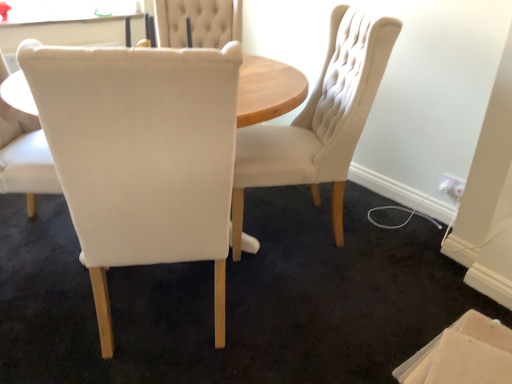
Question: Could beige cardboard box at lower right be considered to be inside matte cream chair at center, which appears as the third chair when viewed from the left?

Choices:
 (A) no
 (B) yes

Answer: (A)

Question: From a real-world perspective, is matte cream chair at center, arranged as the first chair when viewed from the right, beneath beige cardboard box at lower right?

Choices:
 (A) no
 (B) yes

Answer: (A)

Question: Can you confirm if matte cream chair at center, which appears as the third chair when viewed from the left, is positioned to the left of beige cardboard box at lower right?

Choices:
 (A) no
 (B) yes

Answer: (B)

Question: Is beige cardboard box at lower right at the back of matte cream chair at center, arranged as the first chair when viewed from the right?

Choices:
 (A) no
 (B) yes

Answer: (A)

Question: Is matte cream chair at center, which appears as the third chair when viewed from the left, to the right of beige cardboard box at lower right from the viewer's perspective?

Choices:
 (A) no
 (B) yes

Answer: (A)

Question: Can you confirm if matte cream chair at center, arranged as the first chair when viewed from the right, is smaller than beige cardboard box at lower right?

Choices:
 (A) yes
 (B) no

Answer: (B)

Question: Could you tell me if white fabric chair at center, which appears as the 3th chair when viewed from the right, is turned towards matte cream chair at center, arranged as the first chair when viewed from the right?

Choices:
 (A) yes
 (B) no

Answer: (A)

Question: Can you confirm if white fabric chair at center, which appears as the 3th chair when viewed from the right, is bigger than matte cream chair at center, which appears as the third chair when viewed from the left?

Choices:
 (A) no
 (B) yes

Answer: (A)

Question: Considering the relative positions of white fabric chair at center, the first chair when ordered from left to right, and matte cream chair at center, arranged as the first chair when viewed from the right, in the image provided, is white fabric chair at center, the first chair when ordered from left to right, to the right of matte cream chair at center, arranged as the first chair when viewed from the right, from the viewer's perspective?

Choices:
 (A) no
 (B) yes

Answer: (A)

Question: Is there a large distance between white fabric chair at center, the first chair when ordered from left to right, and matte cream chair at center, arranged as the first chair when viewed from the right?

Choices:
 (A) yes
 (B) no

Answer: (A)

Question: Considering the relative sizes of white fabric chair at center, the first chair when ordered from left to right, and matte cream chair at center, arranged as the first chair when viewed from the right, in the image provided, is white fabric chair at center, the first chair when ordered from left to right, smaller than matte cream chair at center, arranged as the first chair when viewed from the right,?

Choices:
 (A) no
 (B) yes

Answer: (B)

Question: Is white fabric chair at center, which appears as the 3th chair when viewed from the right, positioned with its back to matte cream chair at center, which appears as the third chair when viewed from the left?

Choices:
 (A) yes
 (B) no

Answer: (B)

Question: Considering the relative sizes of matte white chair at center, acting as the second chair starting from the left, and beige cardboard box at lower right in the image provided, is matte white chair at center, acting as the second chair starting from the left, wider than beige cardboard box at lower right?

Choices:
 (A) no
 (B) yes

Answer: (B)